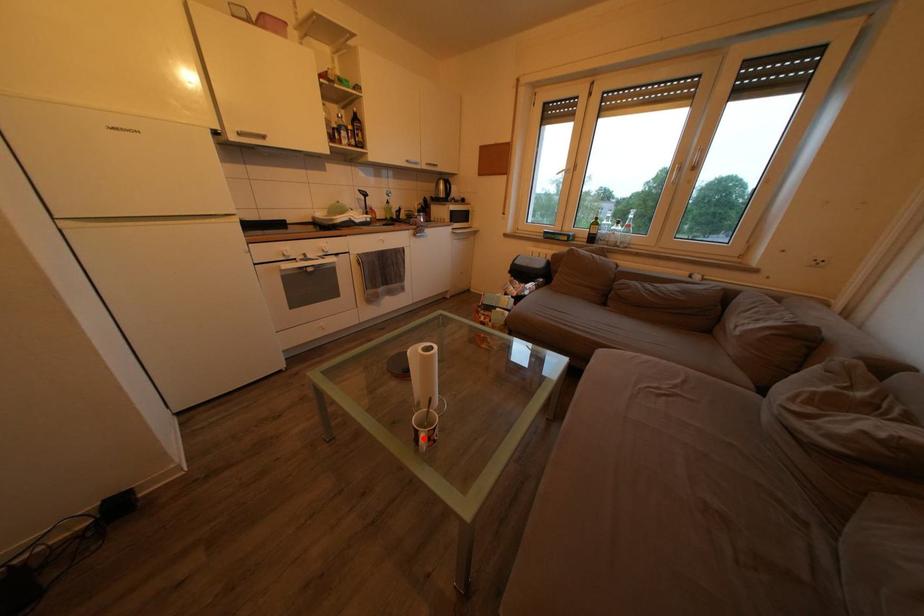
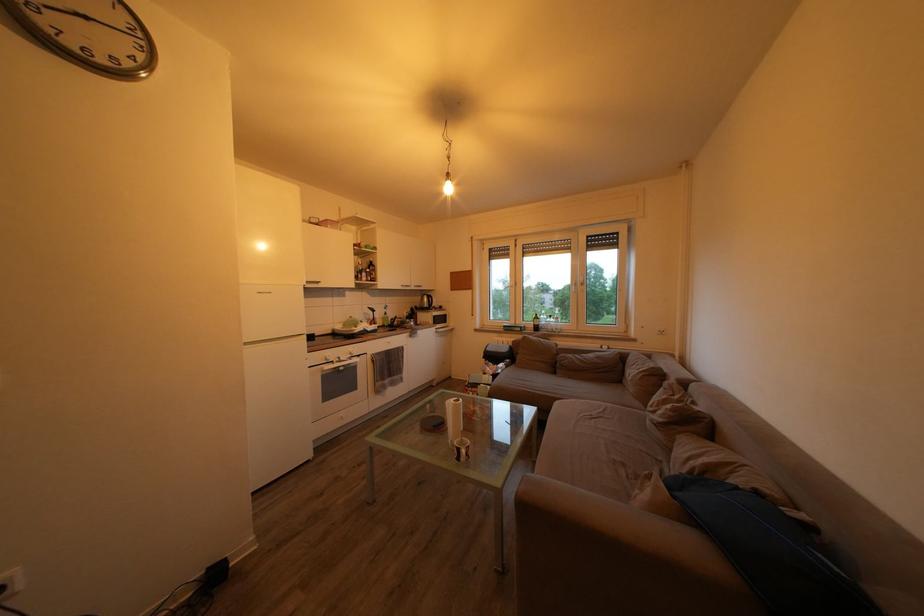
Where in the second image is the point corresponding to the highlighted location from the first image?

(467, 456)